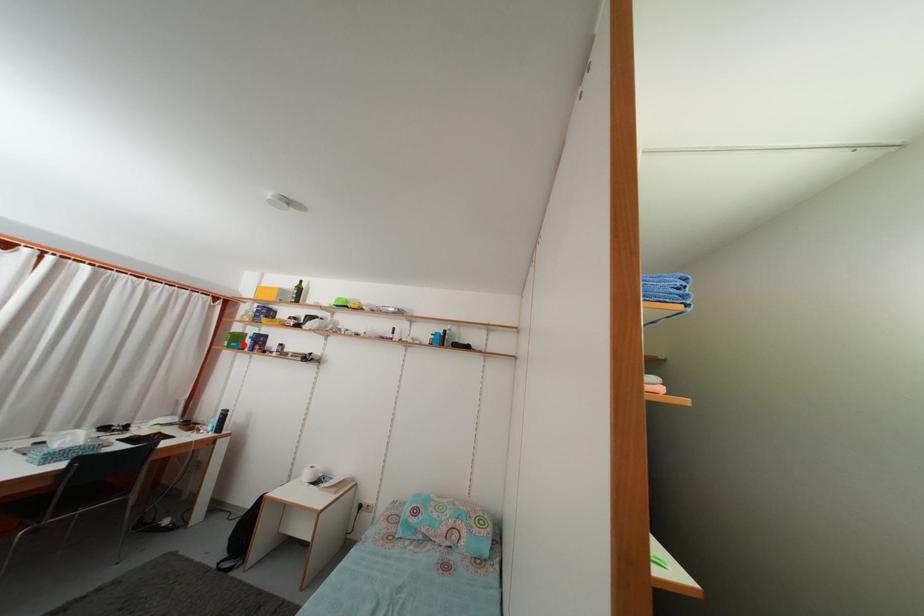
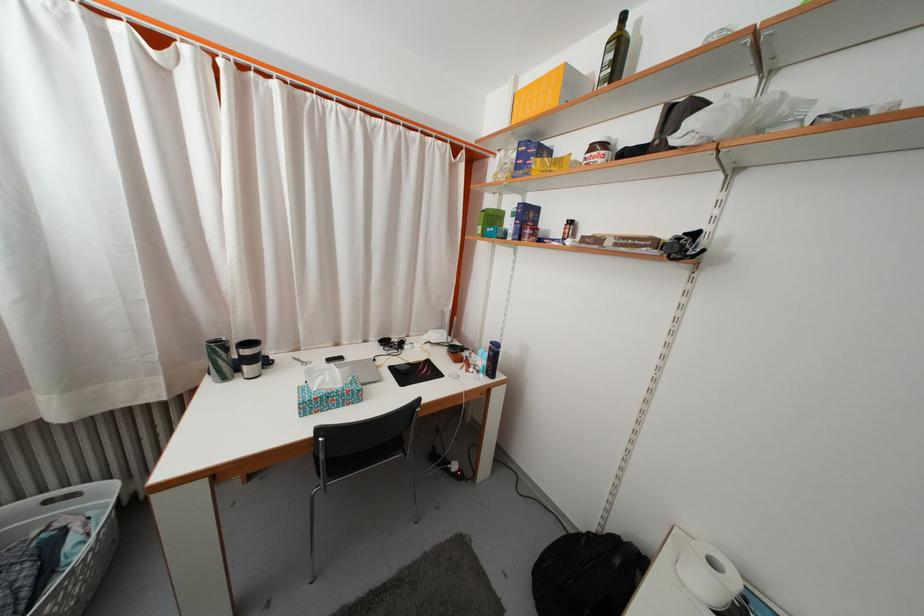
Question: I am providing you with two images of the same scene from different viewpoints. In image1, a red point is highlighted. Considering the same 3D point in image2, which of the following is correct?

Choices:
 (A) It is closer
 (B) It is farther

Answer: (A)